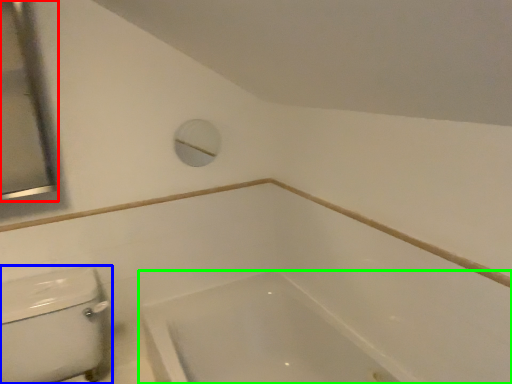
Question: Which object is the farthest from mirror (highlighted by a red box)? Choose among these: porcelain (highlighted by a blue box) or bathtub (highlighted by a green box).

Choices:
 (A) porcelain
 (B) bathtub

Answer: (B)